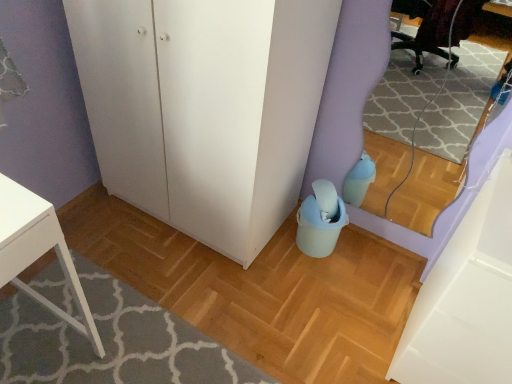
Question: From the image's perspective, is white matte cabinet at lower right above or below white matte cabinet at lower right?

Choices:
 (A) above
 (B) below

Answer: (A)

Question: Considering the positions of white matte cabinet at lower right and white matte cabinet at lower right in the image, is white matte cabinet at lower right wider or thinner than white matte cabinet at lower right?

Choices:
 (A) thin
 (B) wide

Answer: (B)

Question: Based on their relative distances, which object is farther from the white matte cabinet at lower right?

Choices:
 (A) white matte cabinet at lower right
 (B) matte plastic bucket at lower center

Answer: (B)

Question: Which of these objects is positioned closest to the matte plastic bucket at lower center?

Choices:
 (A) white matte cabinet at lower right
 (B) white matte cabinet at lower right

Answer: (B)